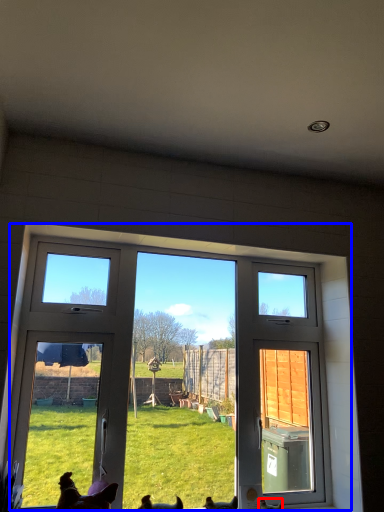
Question: Which object appears closest to the camera in this image, chicken (highlighted by a red box) or window (highlighted by a blue box)?

Choices:
 (A) chicken
 (B) window

Answer: (B)